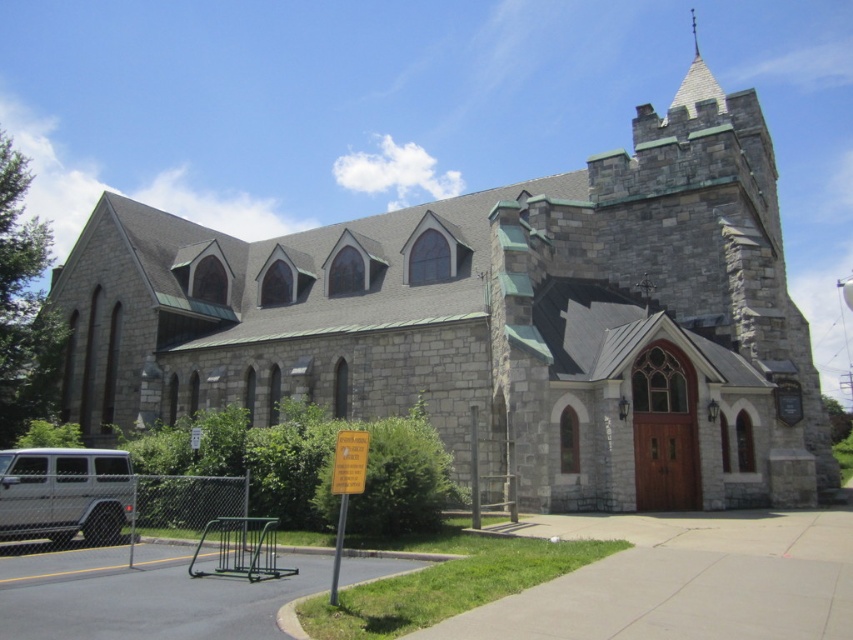
You are a photographer planning to capture the entire structure of the church and the van in one shot. Given that the camera you are using has a fixed focal length that can only accommodate objects with a maximum width of 3 meters, can both the silver metallic van at lower left and the gray stone spire at upper center fit within the frame?

The silver metallic van at lower left has a lesser width compared to the gray stone spire at upper center. Since the spire is wider than the van, and the maximum width the camera can accommodate is 3 meters, it depends on the actual width of the spire. However, the description only states the comparative width between the two objects, not their absolute measurements. Without knowing the exact width of the spire, we cannot definitively confirm if both will fit within the 3 meters limit.

You are a delivery driver who needs to park your silver metallic van at lower left closer to the gray stone spire at upper center. Given that the parking space available is 60 meters long, can you safely maneuver your van into the space without exceeding its length?

The distance between the silver metallic van at lower left and the gray stone spire at upper center is 63.70 meters. Since the parking space is only 60 meters long, the van cannot be parked there without exceeding the space length.